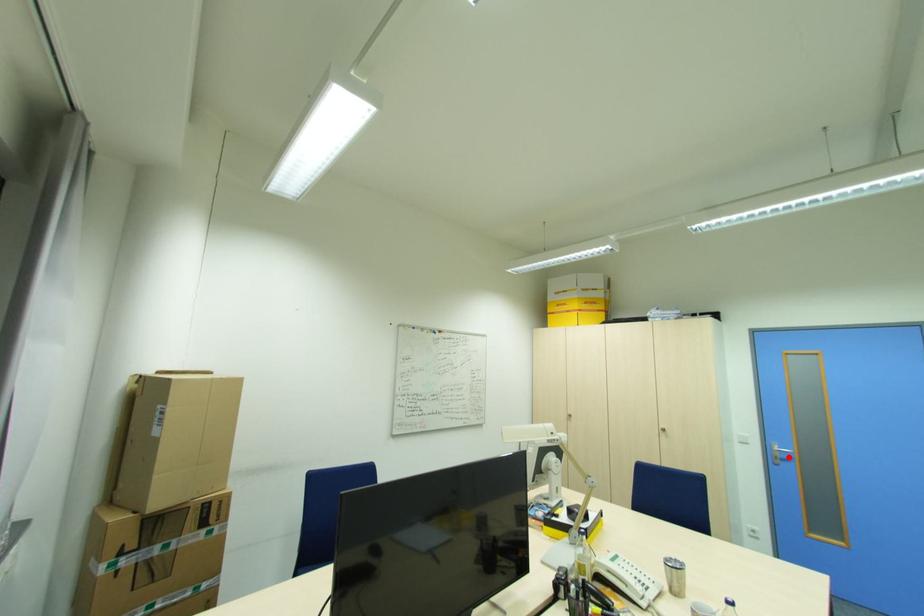
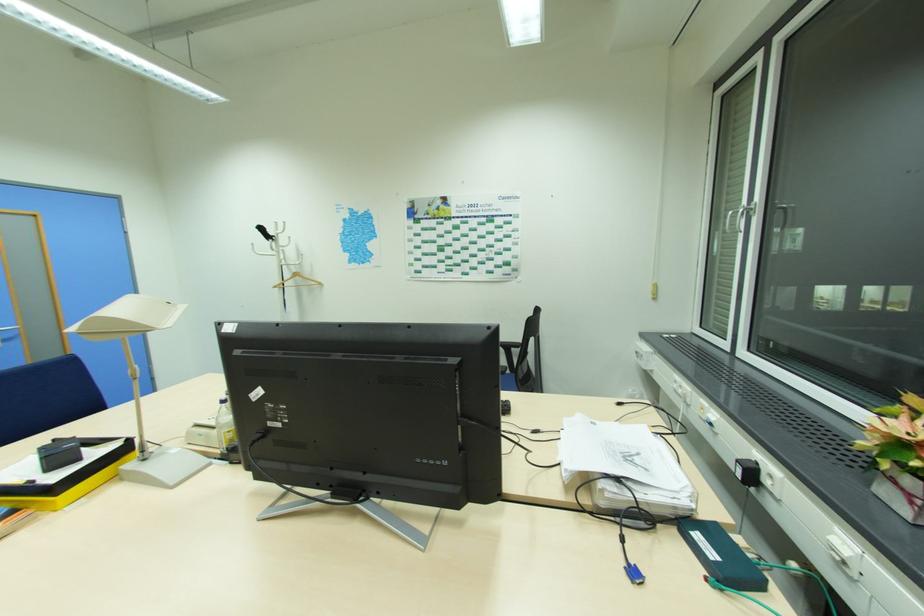
Find the pixel in the second image that matches the highlighted location in the first image.

(11, 337)